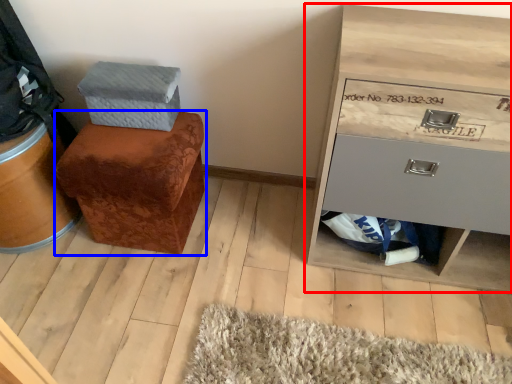
Question: Among these objects, which one is farthest to the camera, chest of drawers (highlighted by a red box) or furniture (highlighted by a blue box)?

Choices:
 (A) chest of drawers
 (B) furniture

Answer: (B)